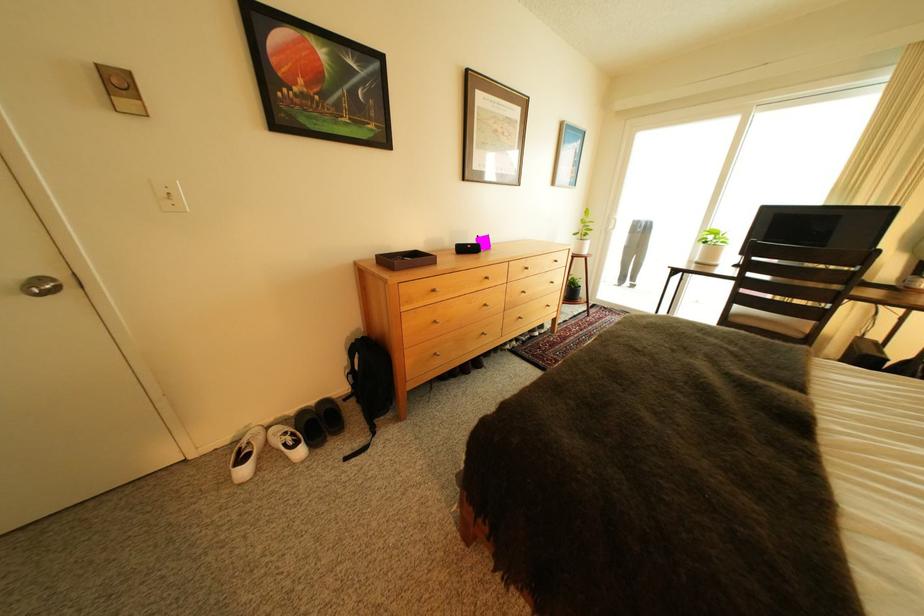
Where would you sit the chair sitting surface? Please return your answer as a coordinate pair (x, y).

(773, 317)